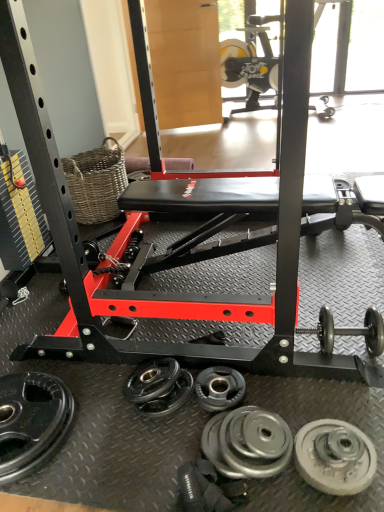
Find the location of a particular element. The height and width of the screenshot is (512, 384). vacant space behind silver metallic weight plate at lower center, which ranks as the third wheel in left-to-right order is located at coordinates (271, 393).